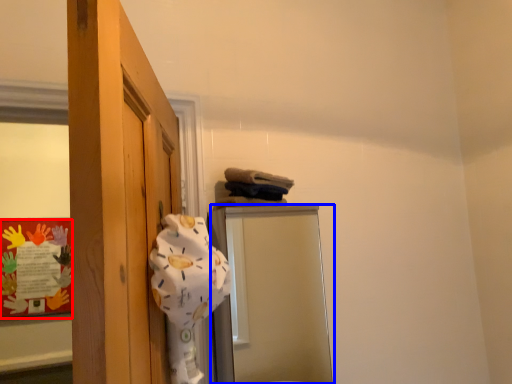
Question: Among these objects, which one is nearest to the camera, bulletin board (highlighted by a red box) or mirror (highlighted by a blue box)?

Choices:
 (A) bulletin board
 (B) mirror

Answer: (B)